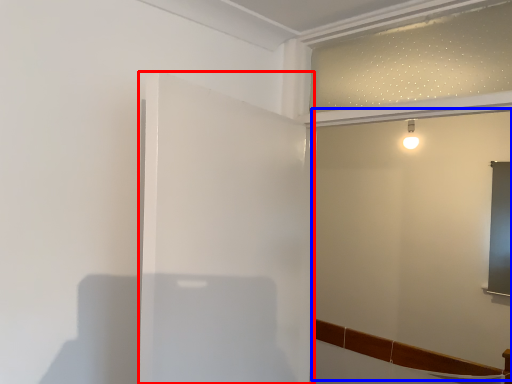
Question: Which point is closer to the camera, screen door (highlighted by a red box) or backdrop (highlighted by a blue box)?

Choices:
 (A) screen door
 (B) backdrop

Answer: (A)